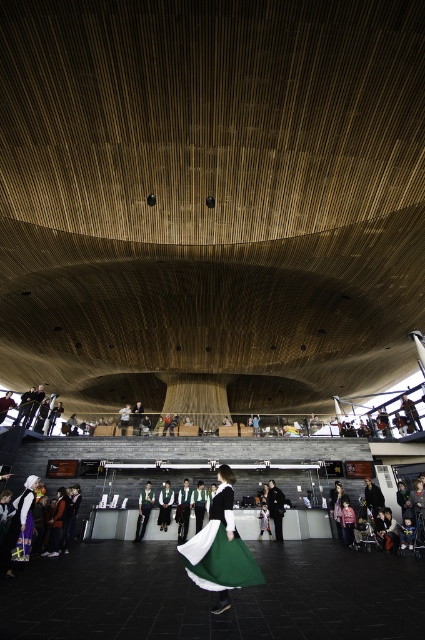
Can you confirm if green satin dress at center is positioned to the right of matte black dress at center?

Incorrect, green satin dress at center is not on the right side of matte black dress at center.

This screenshot has height=640, width=425. What do you see at coordinates (220, 548) in the screenshot? I see `green satin dress at center` at bounding box center [220, 548].

Find the location of a particular element. green satin dress at center is located at coordinates (220, 548).